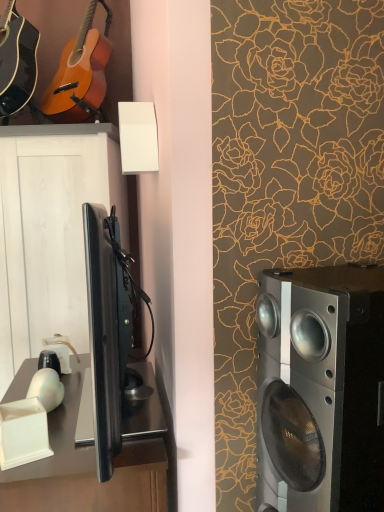
Question: Would you say silver metallic speaker at right is part of satin black desk at lower left's contents?

Choices:
 (A) no
 (B) yes

Answer: (A)

Question: Does satin black desk at lower left have a smaller size compared to silver metallic speaker at right?

Choices:
 (A) no
 (B) yes

Answer: (A)

Question: Is satin black desk at lower left shorter than silver metallic speaker at right?

Choices:
 (A) yes
 (B) no

Answer: (B)

Question: Is satin black desk at lower left further to camera compared to silver metallic speaker at right?

Choices:
 (A) yes
 (B) no

Answer: (A)

Question: Can you confirm if satin black desk at lower left is wider than silver metallic speaker at right?

Choices:
 (A) no
 (B) yes

Answer: (B)

Question: Is satin black desk at lower left outside silver metallic speaker at right?

Choices:
 (A) no
 (B) yes

Answer: (B)

Question: Is matte black acoustic guitar at upper left, marked as the first guitar in a left-to-right arrangement, at the left side of black glossy cabinet at left?

Choices:
 (A) no
 (B) yes

Answer: (B)

Question: Does matte black acoustic guitar at upper left, which is counted as the second guitar, starting from the right, have a lesser height compared to black glossy cabinet at left?

Choices:
 (A) no
 (B) yes

Answer: (B)

Question: Does matte black acoustic guitar at upper left, marked as the first guitar in a left-to-right arrangement, have a greater width compared to black glossy cabinet at left?

Choices:
 (A) yes
 (B) no

Answer: (B)

Question: Is matte black acoustic guitar at upper left, marked as the first guitar in a left-to-right arrangement, positioned in front of black glossy cabinet at left?

Choices:
 (A) no
 (B) yes

Answer: (B)

Question: From a real-world perspective, is matte black acoustic guitar at upper left, marked as the first guitar in a left-to-right arrangement, over black glossy cabinet at left?

Choices:
 (A) yes
 (B) no

Answer: (A)

Question: Is matte black acoustic guitar at upper left, which is counted as the second guitar, starting from the right, not within black glossy cabinet at left?

Choices:
 (A) yes
 (B) no

Answer: (A)

Question: From a real-world perspective, is silver metallic speaker at right located beneath satin black desk at lower left?

Choices:
 (A) no
 (B) yes

Answer: (A)